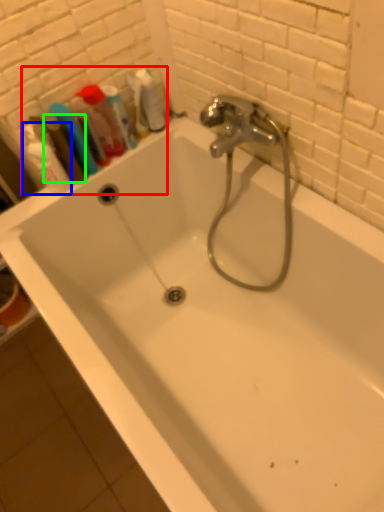
Question: Estimate the real-world distances between objects in this image. Which object is closer to toiletry (highlighted by a red box), shaving cream (highlighted by a blue box) or mouthwash (highlighted by a green box)?

Choices:
 (A) shaving cream
 (B) mouthwash

Answer: (B)